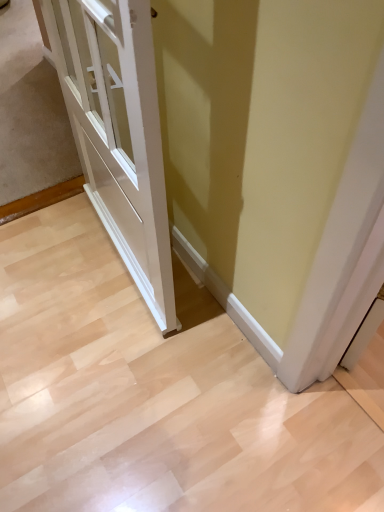
The height and width of the screenshot is (512, 384). What do you see at coordinates (153, 394) in the screenshot?
I see `light wood floor at center` at bounding box center [153, 394].

What are the coordinates of `light wood floor at center` in the screenshot? It's located at (153, 394).

Measure the distance between light wood floor at center and camera.

light wood floor at center and camera are 3.29 feet apart from each other.

At what (x,y) coordinates should I click in order to perform the action: click on light wood floor at center. Please return your answer as a coordinate pair (x, y). The image size is (384, 512). Looking at the image, I should click on (153, 394).